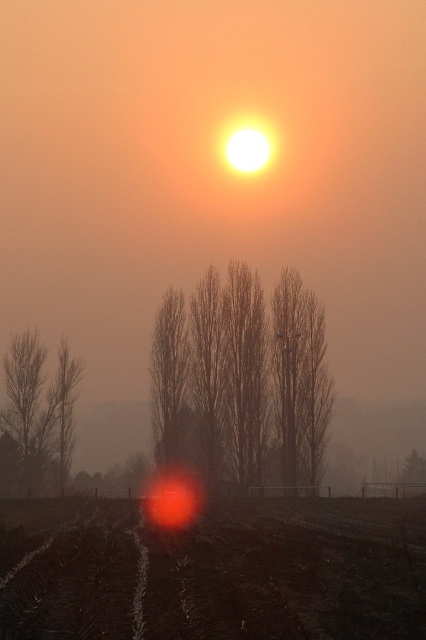
Does point (206, 410) come behind point (161, 314)?

That is False.

Who is more distant from viewer, (273, 358) or (178, 419)?

The point (178, 419) is more distant.

In order to click on silhouetted bare trees at center in this screenshot , I will do `click(241, 380)`.

Does silhouetted bare trees at center appear on the left side of silhouette bare tree at left?

In fact, silhouetted bare trees at center is to the right of silhouette bare tree at left.

Is silhouetted bare trees at center wider than silhouette bare tree at left?

Correct, the width of silhouetted bare trees at center exceeds that of silhouette bare tree at left.

Describe the element at coordinates (241, 380) in the screenshot. I see `silhouetted bare trees at center` at that location.

This screenshot has height=640, width=426. I want to click on silhouetted bare trees at center, so click(x=241, y=380).

Does silhouette bare tree at left lie in front of brown textured tree at center?

No.

Does silhouette bare tree at left have a greater width compared to brown textured tree at center?

Yes.

I want to click on silhouette bare tree at left, so click(x=40, y=410).